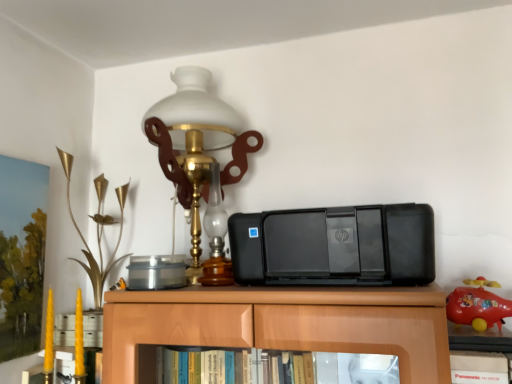
Question: Should I look upward or downward to see gold metallic flower at left, marked as the first toy in a left-to-right arrangement?

Choices:
 (A) down
 (B) up

Answer: (A)

Question: From the image's perspective, is rubberized red toy airplane at right, marked as the 1th toy in a front-to-back arrangement, on top of gold metallic flower at left, which appears as the 2th toy when viewed from the front?

Choices:
 (A) no
 (B) yes

Answer: (A)

Question: Could you tell me if rubberized red toy airplane at right, which ranks as the 1th toy in right-to-left order, is facing gold metallic flower at left, the 2th toy from the right?

Choices:
 (A) yes
 (B) no

Answer: (B)

Question: Does rubberized red toy airplane at right, marked as the 1th toy in a front-to-back arrangement, have a greater height compared to gold metallic flower at left, which appears as the 2th toy when viewed from the front?

Choices:
 (A) no
 (B) yes

Answer: (A)

Question: Considering the relative sizes of rubberized red toy airplane at right, which ranks as the 1th toy in right-to-left order, and gold metallic flower at left, which appears as the 2th toy when viewed from the front, in the image provided, is rubberized red toy airplane at right, which ranks as the 1th toy in right-to-left order, smaller than gold metallic flower at left, which appears as the 2th toy when viewed from the front,?

Choices:
 (A) yes
 (B) no

Answer: (A)

Question: Can we say rubberized red toy airplane at right, which ranks as the 1th toy in right-to-left order, lies outside gold metallic flower at left, marked as the first toy in a back-to-front arrangement?

Choices:
 (A) no
 (B) yes

Answer: (B)

Question: Is gold metallic flower at left, the 2th toy from the right, a part of rubberized red toy airplane at right, which ranks as the 1th toy in right-to-left order?

Choices:
 (A) no
 (B) yes

Answer: (A)

Question: From a real-world perspective, does black plastic printer at center sit lower than rubberized red toy airplane at right, marked as the 2th toy in a back-to-front arrangement?

Choices:
 (A) yes
 (B) no

Answer: (B)

Question: Is black plastic printer at center bigger than rubberized red toy airplane at right, marked as the 2th toy in a back-to-front arrangement?

Choices:
 (A) no
 (B) yes

Answer: (B)

Question: Can you confirm if black plastic printer at center is taller than rubberized red toy airplane at right, the second toy viewed from the left?

Choices:
 (A) yes
 (B) no

Answer: (A)

Question: Considering the relative positions of black plastic printer at center and rubberized red toy airplane at right, which ranks as the 1th toy in right-to-left order, in the image provided, is black plastic printer at center to the right of rubberized red toy airplane at right, which ranks as the 1th toy in right-to-left order, from the viewer's perspective?

Choices:
 (A) no
 (B) yes

Answer: (A)

Question: Is black plastic printer at center at the left side of rubberized red toy airplane at right, marked as the 1th toy in a front-to-back arrangement?

Choices:
 (A) yes
 (B) no

Answer: (A)

Question: Is rubberized red toy airplane at right, which ranks as the 1th toy in right-to-left order, surrounded by black plastic printer at center?

Choices:
 (A) yes
 (B) no

Answer: (B)

Question: Considering the relative sizes of rubberized red toy airplane at right, the second toy viewed from the left, and black plastic printer at center in the image provided, is rubberized red toy airplane at right, the second toy viewed from the left, shorter than black plastic printer at center?

Choices:
 (A) no
 (B) yes

Answer: (B)